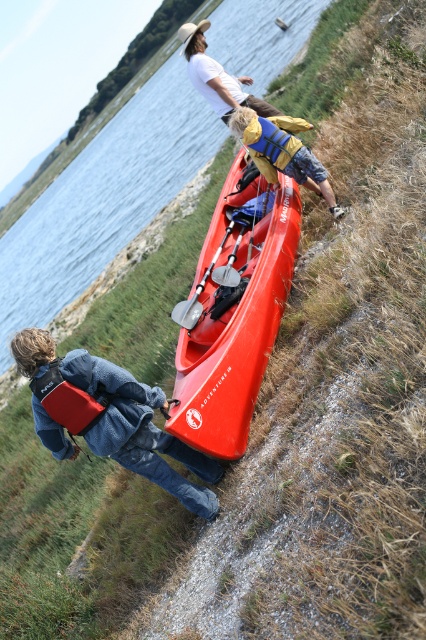
You are standing in the scene and want to locate the denim jacket at lower left and the white cotton shirt at upper center. Which one is positioned to the left of the other?

The denim jacket at lower left is to the left of the white cotton shirt at upper center.

You are a safety inspector checking the kayaking setup. You notice the red matte life jacket at lower left and the silver metallic paddle at center. According to safety guidelines, life jackets must be easily accessible and not obstructed by other equipment. Is the current arrangement compliant with safety standards?

The red matte life jacket at lower left is in front of the silver metallic paddle at center, so it is easily accessible and not obstructed by the paddle. The arrangement complies with safety standards.